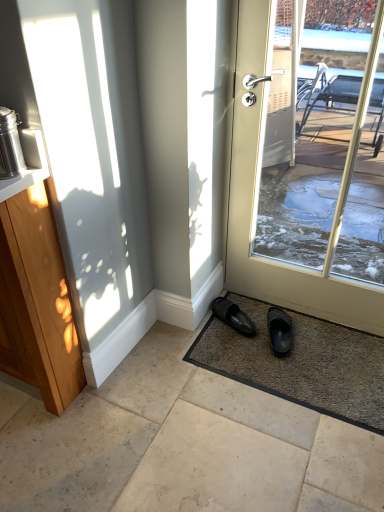
The width and height of the screenshot is (384, 512). I want to click on unoccupied area in front of brown textured mat at lower center, so click(x=278, y=452).